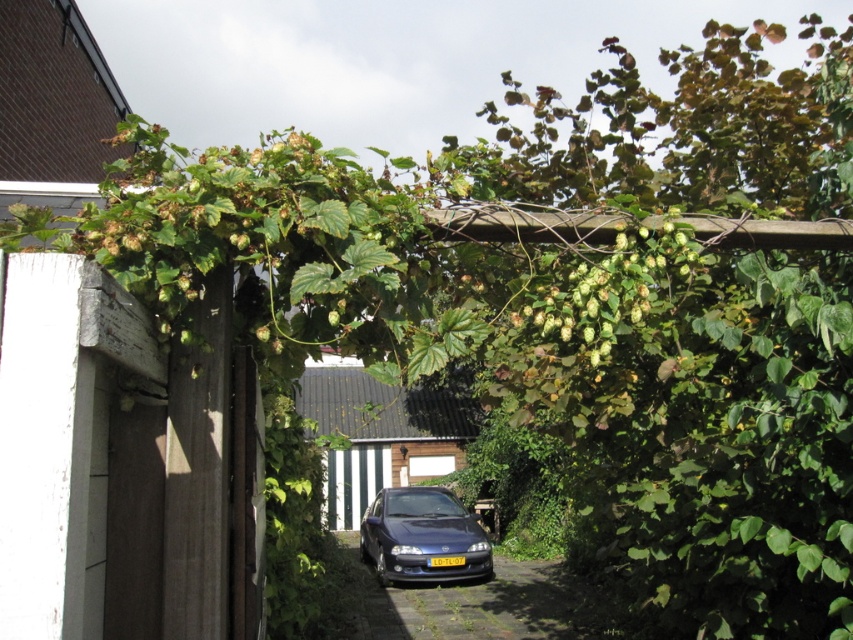
Question: Is black asphalt driveway at center thinner than shiny dark blue sedan at center?

Choices:
 (A) yes
 (B) no

Answer: (A)

Question: Among these points, which one is farthest from the camera?

Choices:
 (A) (554, 604)
 (B) (448, 500)

Answer: (B)

Question: Does black asphalt driveway at center have a greater width compared to shiny dark blue sedan at center?

Choices:
 (A) no
 (B) yes

Answer: (A)

Question: Does black asphalt driveway at center appear on the left side of shiny dark blue sedan at center?

Choices:
 (A) yes
 (B) no

Answer: (B)